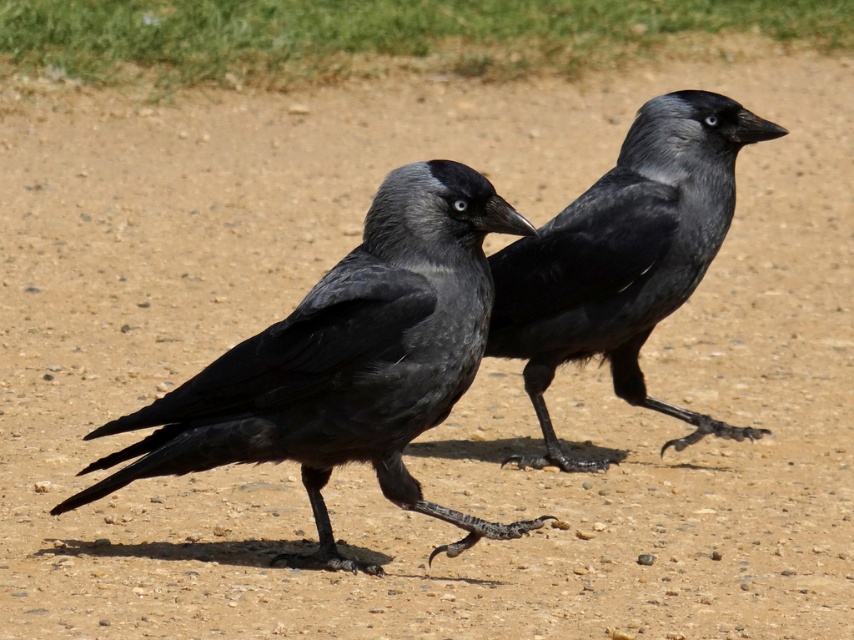
You are a birdwatcher trying to photograph two ravens in the image. You notice that one is a matte black raven at center and the other is a shiny black raven at center. Which raven should you focus on first if you want to take a photo without moving your camera position?

You should focus on the matte black raven at center first because it is closer to the viewer than the shiny black raven at center, so adjusting the camera focus for the closer one first would be more efficient.

You are a birdwatcher observing two ravens in a park. You notice a matte black raven at center and a shiny black raven at center. Which raven is casting a shadow on the other?

The matte black raven at center is positioned under the shiny black raven at center, so the shiny black raven at center is casting its shadow on the matte black raven at center.

You are a birdwatcher trying to identify two ravens in the image. The scene shows a matte black raven at center and a shiny black raven at center. Which raven has a greater width?

The matte black raven at center has a greater width than the shiny black raven at center according to the description.